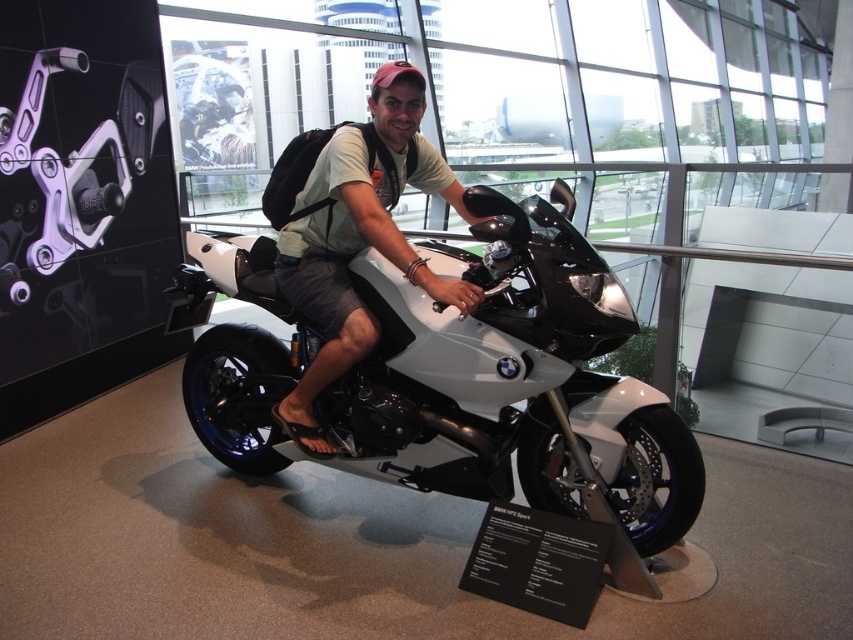
You are standing in the exhibition space and want to take a photo of the man on the BMW HP2 Sport motorcycle. The camera you have can only focus on objects within 2 meters. Is the point at coordinates point (688, 444) within the camera focus range?

The distance between point (688, 444) and the viewer is 2.20 meters, which is beyond the camera focus range of 2 meters. Therefore, the camera cannot focus on that point.

You are a photographer planning to take a photo of the white glossy motorcycle at center and the matte black motorcycle at center. Since the exhibition space has limited height, you need to ensure that both motorcycles are fully visible in the frame. Based on their positions, will you be able to capture both motorcycles in a single photo without cropping any part of them?

The white glossy motorcycle at center is below the matte black motorcycle at center, so you can position the camera to include both in the frame by angling it to capture the lower position of the white glossy motorcycle at center and the higher position of the matte black motorcycle at center without cropping.

You are a photographer standing in the exhibition space and want to take a photo of both the white glossy motorcycle at center and the matte black motorcycle at center. Which motorcycle should you focus on first to ensure both are in the frame?

You should focus on the white glossy motorcycle at center first because it is in front of the matte black motorcycle at center, so positioning the camera to include the front motorcycle will naturally include the one behind it as well.